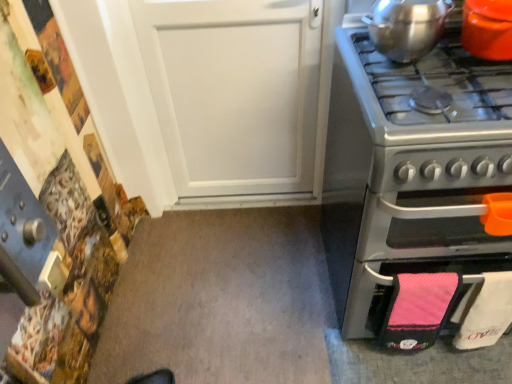
Question: Would you say stainless steel oven at right is outside shiny metallic pot at upper right, the first kitchen appliance positioned from the left?

Choices:
 (A) yes
 (B) no

Answer: (A)

Question: Is shiny metallic pot at upper right, the first kitchen appliance positioned from the left, located within stainless steel oven at right?

Choices:
 (A) yes
 (B) no

Answer: (B)

Question: Considering the relative positions of stainless steel oven at right and shiny metallic pot at upper right, positioned as the 2th kitchen appliance in right-to-left order, in the image provided, is stainless steel oven at right behind shiny metallic pot at upper right, positioned as the 2th kitchen appliance in right-to-left order,?

Choices:
 (A) yes
 (B) no

Answer: (B)

Question: Are stainless steel oven at right and shiny metallic pot at upper right, positioned as the 2th kitchen appliance in right-to-left order, far apart?

Choices:
 (A) yes
 (B) no

Answer: (B)

Question: Is shiny metallic pot at upper right, positioned as the 2th kitchen appliance in right-to-left order, at the back of stainless steel oven at right?

Choices:
 (A) yes
 (B) no

Answer: (B)

Question: Is orange glossy pot at upper right, which ranks as the second kitchen appliance in left-to-right order, situated inside shiny metallic pot at upper right, the first kitchen appliance positioned from the left, or outside?

Choices:
 (A) outside
 (B) inside

Answer: (A)

Question: Relative to shiny metallic pot at upper right, positioned as the 2th kitchen appliance in right-to-left order, is orange glossy pot at upper right, which ranks as the second kitchen appliance in left-to-right order, in front or behind?

Choices:
 (A) behind
 (B) front

Answer: (B)

Question: From the image's perspective, is orange glossy pot at upper right, which ranks as the second kitchen appliance in left-to-right order, above or below shiny metallic pot at upper right, the first kitchen appliance positioned from the left?

Choices:
 (A) above
 (B) below

Answer: (B)

Question: Based on their positions, is orange glossy pot at upper right, which ranks as the second kitchen appliance in left-to-right order, located to the left or right of shiny metallic pot at upper right, the first kitchen appliance positioned from the left?

Choices:
 (A) right
 (B) left

Answer: (A)

Question: From the image's perspective, relative to stainless steel oven at right, is shiny metallic pot at upper right, the first kitchen appliance positioned from the left, above or below?

Choices:
 (A) above
 (B) below

Answer: (A)

Question: Choose the correct answer: Is shiny metallic pot at upper right, the first kitchen appliance positioned from the left, inside stainless steel oven at right or outside it?

Choices:
 (A) outside
 (B) inside

Answer: (A)

Question: Visually, is shiny metallic pot at upper right, the first kitchen appliance positioned from the left, positioned to the left or to the right of stainless steel oven at right?

Choices:
 (A) left
 (B) right

Answer: (A)

Question: Considering the positions of shiny metallic pot at upper right, the first kitchen appliance positioned from the left, and stainless steel oven at right in the image, is shiny metallic pot at upper right, the first kitchen appliance positioned from the left, wider or thinner than stainless steel oven at right?

Choices:
 (A) thin
 (B) wide

Answer: (A)

Question: Visually, is shiny metallic pot at upper right, the first kitchen appliance positioned from the left, positioned to the left or to the right of orange glossy pot at upper right, which ranks as the second kitchen appliance in left-to-right order?

Choices:
 (A) left
 (B) right

Answer: (A)

Question: Does point (386, 43) appear closer or farther from the camera than point (479, 49)?

Choices:
 (A) closer
 (B) farther

Answer: (B)